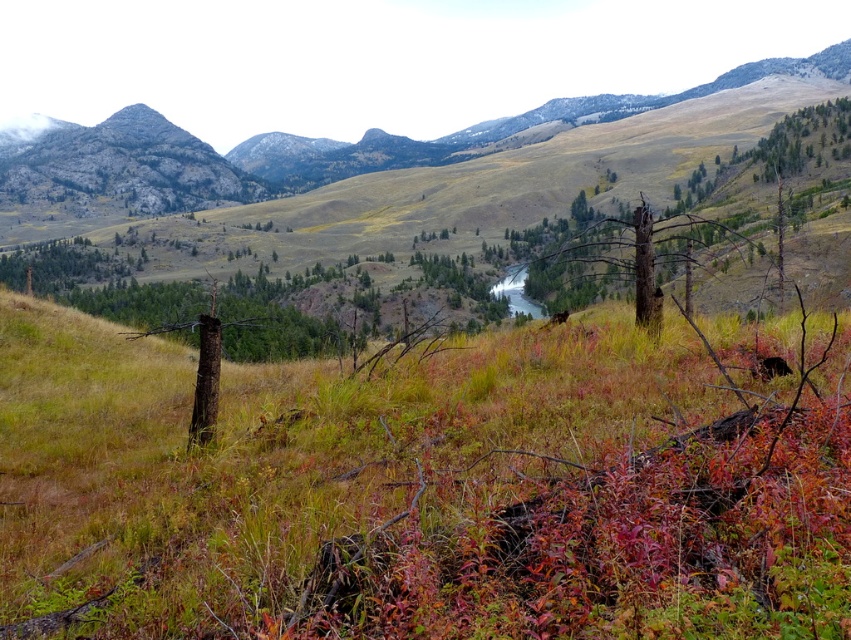
Who is lower down, green grassy at center or brown rough tree at center?

green grassy at center is below.

Does green grassy at center have a smaller size compared to brown rough tree at center?

Yes.

This screenshot has width=851, height=640. I want to click on green grassy at center, so click(x=426, y=486).